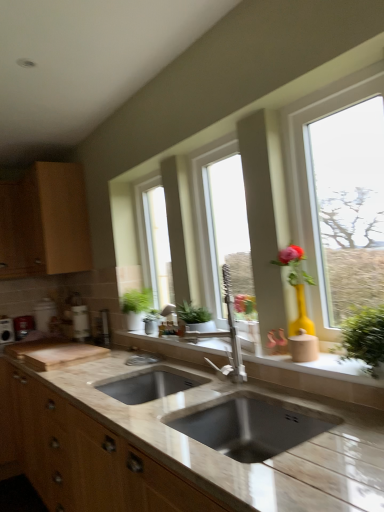
Question: Could clear glass window at center, the 2th window when ordered from front to back, be considered to be inside beige stone sink at center?

Choices:
 (A) yes
 (B) no

Answer: (B)

Question: Considering the relative positions of beige stone sink at center and clear glass window at center, which ranks as the second window in left-to-right order, in the image provided, is beige stone sink at center behind clear glass window at center, which ranks as the second window in left-to-right order,?

Choices:
 (A) yes
 (B) no

Answer: (B)

Question: From the image's perspective, does beige stone sink at center appear higher than clear glass window at center, which appears as the second window when viewed from the right?

Choices:
 (A) yes
 (B) no

Answer: (B)

Question: Considering the relative sizes of beige stone sink at center and clear glass window at center, the 2th window when ordered from front to back, in the image provided, is beige stone sink at center taller than clear glass window at center, the 2th window when ordered from front to back,?

Choices:
 (A) yes
 (B) no

Answer: (B)

Question: Considering the relative positions of beige stone sink at center and clear glass window at center, which appears as the second window when viewed from the right, in the image provided, is beige stone sink at center to the right of clear glass window at center, which appears as the second window when viewed from the right, from the viewer's perspective?

Choices:
 (A) yes
 (B) no

Answer: (B)

Question: Is point (203, 205) positioned closer to the camera than point (365, 69)?

Choices:
 (A) farther
 (B) closer

Answer: (A)

Question: Looking at their shapes, would you say clear glass window at center, which ranks as the second window in left-to-right order, is wider or thinner than yellow matte vase at right, which is the first window from right to left?

Choices:
 (A) thin
 (B) wide

Answer: (A)

Question: From a real-world perspective, is clear glass window at center, which ranks as the second window in left-to-right order, positioned above or below yellow matte vase at right, the third window viewed from the left?

Choices:
 (A) above
 (B) below

Answer: (A)

Question: From the image's perspective, is clear glass window at center, the 2th window when ordered from front to back, positioned above or below yellow matte vase at right, the 1th window when ordered from front to back?

Choices:
 (A) below
 (B) above

Answer: (A)

Question: In the image, is green matte plant at center, arranged as the 1th window when viewed from the back, positioned in front of or behind beige stone sink at center?

Choices:
 (A) behind
 (B) front

Answer: (A)

Question: Is point (168, 258) closer or farther from the camera than point (271, 373)?

Choices:
 (A) closer
 (B) farther

Answer: (B)

Question: Is green matte plant at center, positioned as the third window in right-to-left order, situated inside beige stone sink at center or outside?

Choices:
 (A) inside
 (B) outside

Answer: (B)

Question: From their relative heights in the image, would you say green matte plant at center, arranged as the 1th window when viewed from the back, is taller or shorter than beige stone sink at center?

Choices:
 (A) tall
 (B) short

Answer: (A)

Question: Looking at their shapes, would you say wooden cabinet at left is wider or thinner than green leafy plant at right, placed as the first houseplant when sorted from front to back?

Choices:
 (A) wide
 (B) thin

Answer: (A)

Question: From a real-world perspective, is wooden cabinet at left positioned above or below green leafy plant at right, the first houseplant viewed from the right?

Choices:
 (A) above
 (B) below

Answer: (A)